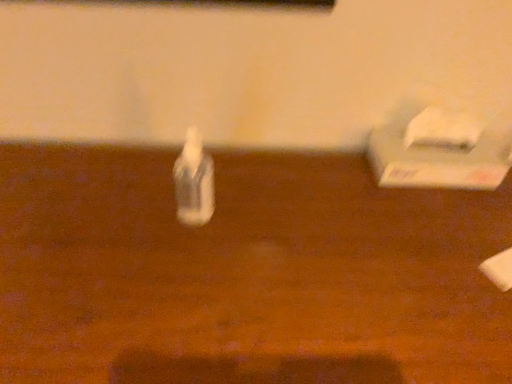
Where is `white matte tissue box at right`? The width and height of the screenshot is (512, 384). white matte tissue box at right is located at coordinates (439, 145).

Identify the location of transparent plastic bottle at center. (x=194, y=181).

From the image's perspective, which is below, white matte tissue box at right or transparent plastic bottle at center?

transparent plastic bottle at center is shown below in the image.

Is the depth of white matte tissue box at right greater than that of transparent plastic bottle at center?

Yes, white matte tissue box at right is further from the viewer.

Which of these two, white matte tissue box at right or transparent plastic bottle at center, is wider?

With larger width is white matte tissue box at right.

Identify the location of bottle that is above the wooden table at center (from a real-world perspective). (194, 181).

Is point (163, 325) more distant than point (195, 147)?

No.

Who is taller, wooden table at center or transparent plastic bottle at center?

wooden table at center.

How distant is wooden table at center from transparent plastic bottle at center?

wooden table at center and transparent plastic bottle at center are 20.39 centimeters apart from each other.

Is wooden table at center taller than white matte tissue box at right?

Yes, wooden table at center is taller than white matte tissue box at right.

Is wooden table at center far from white matte tissue box at right?

No, wooden table at center is not far away from white matte tissue box at right.

Consider the image. From a real-world perspective, who is located lower, wooden table at center or white matte tissue box at right?

wooden table at center.

Which object is closer to the camera taking this photo, wooden table at center or white matte tissue box at right?

Positioned in front is wooden table at center.

Is transparent plastic bottle at center bigger than wooden table at center?

Incorrect, transparent plastic bottle at center is not larger than wooden table at center.

From a real-world perspective, between transparent plastic bottle at center and wooden table at center, who is vertically lower?

From a 3D spatial view, wooden table at center is below.

In terms of height, does transparent plastic bottle at center look taller or shorter compared to wooden table at center?

transparent plastic bottle at center is shorter than wooden table at center.

Is transparent plastic bottle at center facing towards white matte tissue box at right?

No, transparent plastic bottle at center is not turned towards white matte tissue box at right.

Can white matte tissue box at right be found inside transparent plastic bottle at center?

Definitely not — white matte tissue box at right is not inside transparent plastic bottle at center.

From a real-world perspective, is transparent plastic bottle at center physically below white matte tissue box at right?

Actually, transparent plastic bottle at center is physically above white matte tissue box at right in the real world.

Is transparent plastic bottle at center thinner than white matte tissue box at right?

Yes.

In the scene shown: Which of these two, white matte tissue box at right or wooden table at center, is thinner?

With smaller width is white matte tissue box at right.

This screenshot has height=384, width=512. Identify the location of table lying below the white matte tissue box at right (from the image's perspective). (244, 273).

Can wooden table at center be found inside white matte tissue box at right?

No, wooden table at center is located outside of white matte tissue box at right.

Where is `bottle above the white matte tissue box at right (from a real-world perspective)`? The width and height of the screenshot is (512, 384). bottle above the white matte tissue box at right (from a real-world perspective) is located at coordinates (194, 181).

You are a GUI agent. You are given a task and a screenshot of the screen. Output one action in this format:
    pyautogui.click(x=<x>, y=<y>)
    Task: Click on the bottle lying on the right of wooden table at center
    This screenshot has width=512, height=384.
    Given the screenshot: What is the action you would take?
    [194, 181]

When comparing their distances from wooden table at center, does white matte tissue box at right or transparent plastic bottle at center seem further?

white matte tissue box at right lies further to wooden table at center than the other object.

Looking at the image, which one is located further to transparent plastic bottle at center, white matte tissue box at right or wooden table at center?

Based on the image, white matte tissue box at right appears to be further to transparent plastic bottle at center.

Considering their positions, is wooden table at center positioned further to transparent plastic bottle at center than white matte tissue box at right?

The object further to transparent plastic bottle at center is white matte tissue box at right.

When comparing their distances from white matte tissue box at right, does wooden table at center or transparent plastic bottle at center seem further?

The object further to white matte tissue box at right is transparent plastic bottle at center.

Looking at the image, which one is located further to white matte tissue box at right, transparent plastic bottle at center or wooden table at center?

transparent plastic bottle at center lies further to white matte tissue box at right than the other object.

Estimate the real-world distances between objects in this image. Which object is further from wooden table at center, transparent plastic bottle at center or white matte tissue box at right?

white matte tissue box at right.

At what (x,y) coordinates should I click in order to perform the action: click on bottle between wooden table at center and white matte tissue box at right in the horizontal direction. Please return your answer as a coordinate pair (x, y). This screenshot has height=384, width=512. Looking at the image, I should click on (194, 181).